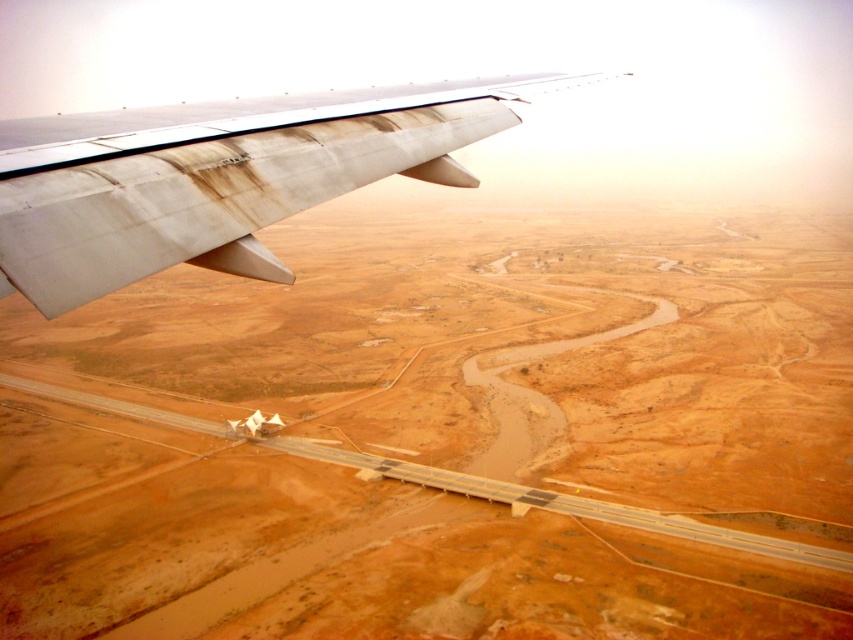
Question: Which point is farther from the camera taking this photo?

Choices:
 (A) (299, 163)
 (B) (793, 566)

Answer: (B)

Question: Does desert sand at upper left have a smaller size compared to rusty aluminum wing at upper left?

Choices:
 (A) no
 (B) yes

Answer: (A)

Question: Among these objects, which one is farthest from the camera?

Choices:
 (A) desert sand at upper left
 (B) rusty aluminum wing at upper left

Answer: (A)

Question: Where is desert sand at upper left located in relation to rusty aluminum wing at upper left in the image?

Choices:
 (A) above
 (B) below

Answer: (A)

Question: Which object appears farthest from the camera in this image?

Choices:
 (A) desert sand at upper left
 (B) rusty aluminum wing at upper left

Answer: (A)

Question: Does desert sand at upper left appear on the right side of rusty aluminum wing at upper left?

Choices:
 (A) no
 (B) yes

Answer: (A)